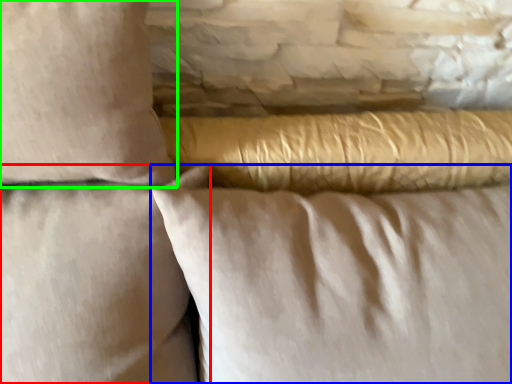
Question: Considering the real-world distances, which object is closest to pillow (highlighted by a red box)? pillow (highlighted by a blue box) or pillow (highlighted by a green box).

Choices:
 (A) pillow
 (B) pillow

Answer: (B)